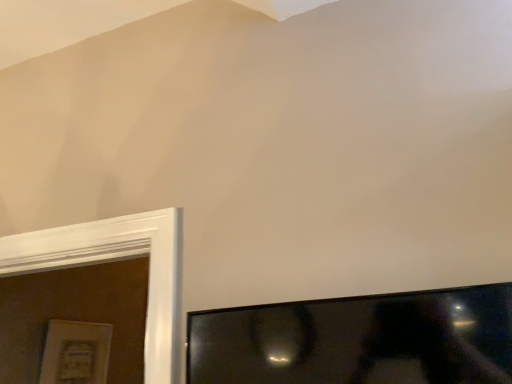
Question: Considering the relative sizes of black glossy tv at lower right and matte white picture frame at lower left in the image provided, is black glossy tv at lower right shorter than matte white picture frame at lower left?

Choices:
 (A) no
 (B) yes

Answer: (B)

Question: Is black glossy tv at lower right positioned with its back to matte white picture frame at lower left?

Choices:
 (A) no
 (B) yes

Answer: (A)

Question: Can you confirm if black glossy tv at lower right is wider than matte white picture frame at lower left?

Choices:
 (A) yes
 (B) no

Answer: (A)

Question: Does black glossy tv at lower right touch matte white picture frame at lower left?

Choices:
 (A) no
 (B) yes

Answer: (A)

Question: Is black glossy tv at lower right bigger than matte white picture frame at lower left?

Choices:
 (A) yes
 (B) no

Answer: (A)

Question: Is black glossy tv at lower right smaller than matte white picture frame at lower left?

Choices:
 (A) yes
 (B) no

Answer: (B)

Question: Is matte white picture frame at lower left aimed at black glossy tv at lower right?

Choices:
 (A) no
 (B) yes

Answer: (B)

Question: From a real-world perspective, is matte white picture frame at lower left positioned over black glossy tv at lower right based on gravity?

Choices:
 (A) yes
 (B) no

Answer: (B)

Question: Is matte white picture frame at lower left in contact with black glossy tv at lower right?

Choices:
 (A) no
 (B) yes

Answer: (A)

Question: Is matte white picture frame at lower left positioned beyond the bounds of black glossy tv at lower right?

Choices:
 (A) no
 (B) yes

Answer: (B)

Question: Would you say black glossy tv at lower right is part of matte white picture frame at lower left's contents?

Choices:
 (A) no
 (B) yes

Answer: (A)

Question: Is matte white picture frame at lower left positioned in front of black glossy tv at lower right?

Choices:
 (A) yes
 (B) no

Answer: (B)

Question: Considering the positions of matte white picture frame at lower left and black glossy tv at lower right in the image, is matte white picture frame at lower left wider or thinner than black glossy tv at lower right?

Choices:
 (A) wide
 (B) thin

Answer: (B)